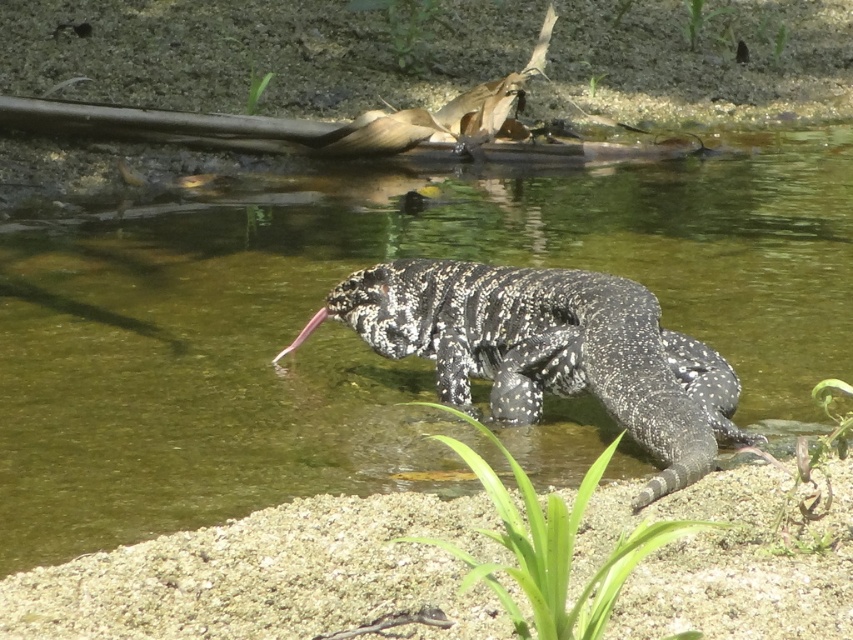
You are a biologist observing the speckled scaly lizard at center and the clear water at center. Which object is located to the right of the other?

The clear water at center is positioned on the left side of the speckled scaly lizard at center, so the speckled scaly lizard at center is to the right of the clear water at center.

Consider the image. You are a biologist observing the speckled scaly lizard at center and the clear water at center. Based on their positions, can you determine if the lizard is fully submerged or partially visible above the water?

The clear water at center is located above the speckled scaly lizard at center, meaning the lizard is partially visible above the water since the water is above it.